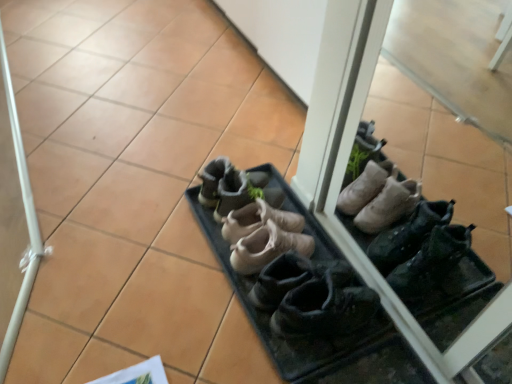
Question: Does black leather shoes at center, arranged as the 5th footwear when viewed from the back, turn towards leather boots at center, the 2th footwear in the front-to-back sequence?

Choices:
 (A) no
 (B) yes

Answer: (A)

Question: Does black leather shoes at center, acting as the 1th footwear starting from the front, have a smaller size compared to leather boots at center, the fourth footwear when ordered from back to front?

Choices:
 (A) yes
 (B) no

Answer: (A)

Question: Is black leather shoes at center, acting as the 1th footwear starting from the front, behind leather boots at center, the fourth footwear when ordered from back to front?

Choices:
 (A) yes
 (B) no

Answer: (B)

Question: From a real-world perspective, is black leather shoes at center, arranged as the 5th footwear when viewed from the back, over leather boots at center, the 2th footwear in the front-to-back sequence?

Choices:
 (A) yes
 (B) no

Answer: (A)

Question: From the image's perspective, is black leather shoes at center, acting as the 1th footwear starting from the front, located beneath leather boots at center, the fourth footwear when ordered from back to front?

Choices:
 (A) no
 (B) yes

Answer: (B)

Question: Can you confirm if black leather shoes at center, arranged as the 5th footwear when viewed from the back, is thinner than leather boots at center, the fourth footwear when ordered from back to front?

Choices:
 (A) yes
 (B) no

Answer: (A)

Question: Would you say tan suede shoes at center, which ranks as the 3th footwear in back-to-front order, is part of leather boots at center, the fourth footwear viewed from the front,'s contents?

Choices:
 (A) no
 (B) yes

Answer: (A)

Question: Are leather boots at center, the fourth footwear viewed from the front, and tan suede shoes at center, which ranks as the 3th footwear in back-to-front order, making contact?

Choices:
 (A) no
 (B) yes

Answer: (B)

Question: Is leather boots at center, the fourth footwear viewed from the front, bigger than tan suede shoes at center, which ranks as the 3th footwear in back-to-front order?

Choices:
 (A) yes
 (B) no

Answer: (B)

Question: Is leather boots at center, arranged as the second footwear when viewed from the back, further to the viewer compared to tan suede shoes at center, which ranks as the 3th footwear in back-to-front order?

Choices:
 (A) yes
 (B) no

Answer: (A)

Question: From the image's perspective, is leather boots at center, the fourth footwear viewed from the front, beneath tan suede shoes at center, which ranks as the 3th footwear in back-to-front order?

Choices:
 (A) yes
 (B) no

Answer: (B)

Question: Can you confirm if leather boots at center, arranged as the second footwear when viewed from the back, is smaller than tan suede shoes at center, which ranks as the 3th footwear in back-to-front order?

Choices:
 (A) no
 (B) yes

Answer: (B)

Question: Considering the relative positions of black leather shoes at center, arranged as the 5th footwear when viewed from the back, and leather boots at center, the 5th footwear in the front-to-back sequence, in the image provided, is black leather shoes at center, arranged as the 5th footwear when viewed from the back, behind leather boots at center, the 5th footwear in the front-to-back sequence,?

Choices:
 (A) no
 (B) yes

Answer: (A)